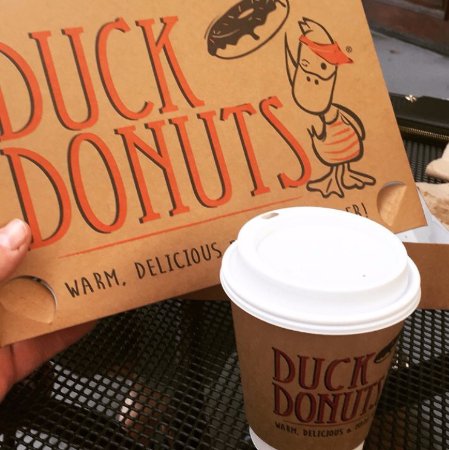
The image size is (449, 450). What are the coordinates of `brown collapsed donut box` in the screenshot? It's located at (110, 253).